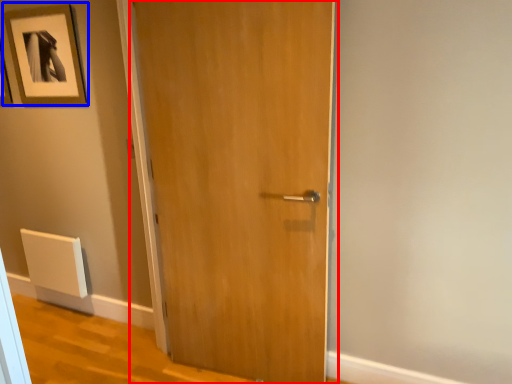
Question: Which of the following is the farthest to the observer, door (highlighted by a red box) or picture frame (highlighted by a blue box)?

Choices:
 (A) door
 (B) picture frame

Answer: (B)